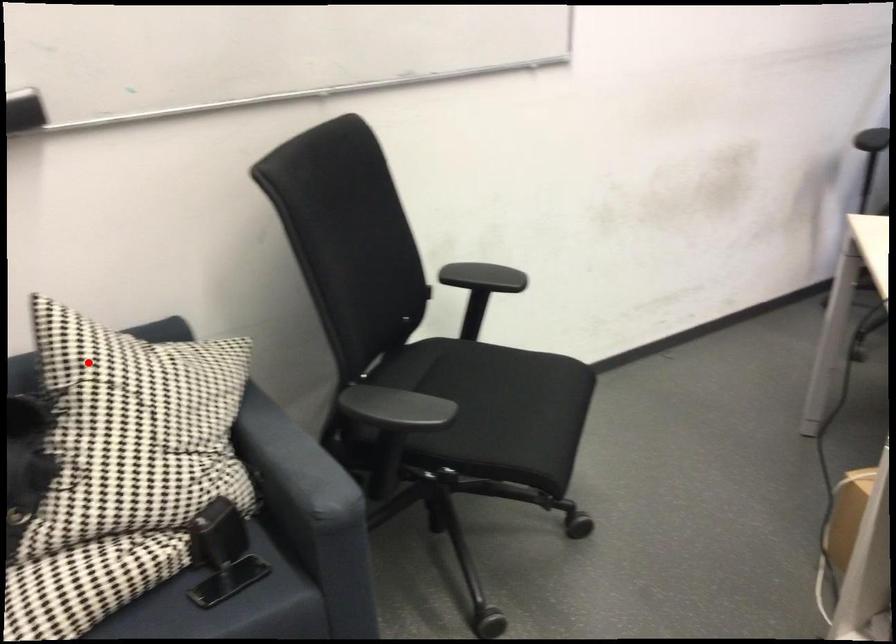
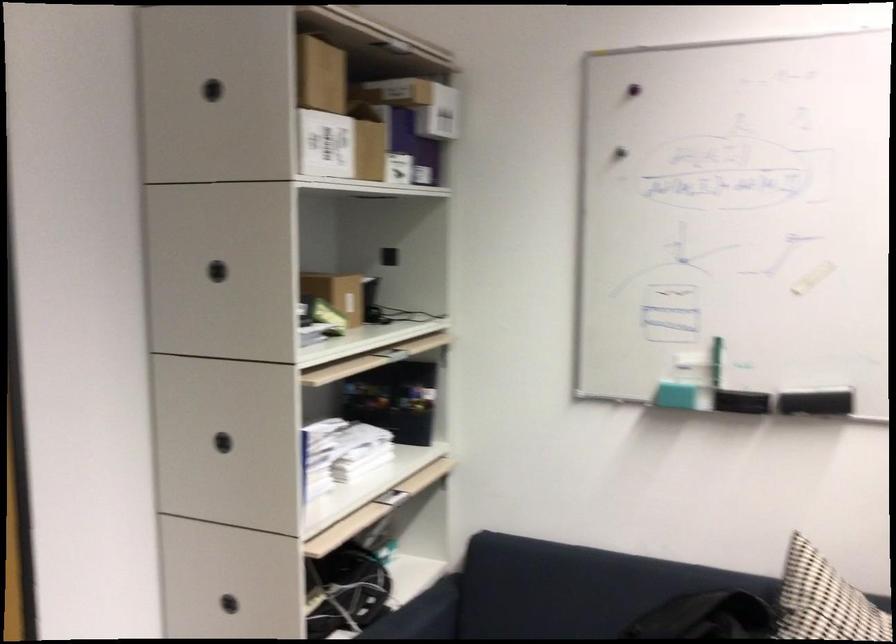
Locate, in the second image, the point that corresponds to the highlighted location in the first image.

(823, 601)